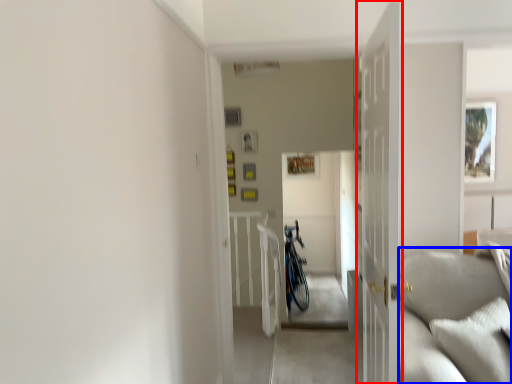
Question: Which point is closer to the camera, door (highlighted by a red box) or couch (highlighted by a blue box)?

Choices:
 (A) door
 (B) couch

Answer: (A)